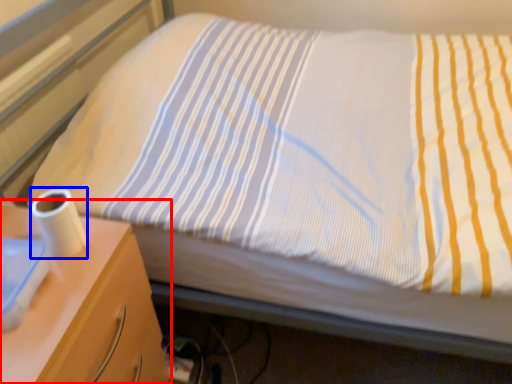
Question: Which point is further to the camera, nightstand (highlighted by a red box) or toilet paper (highlighted by a blue box)?

Choices:
 (A) nightstand
 (B) toilet paper

Answer: (B)